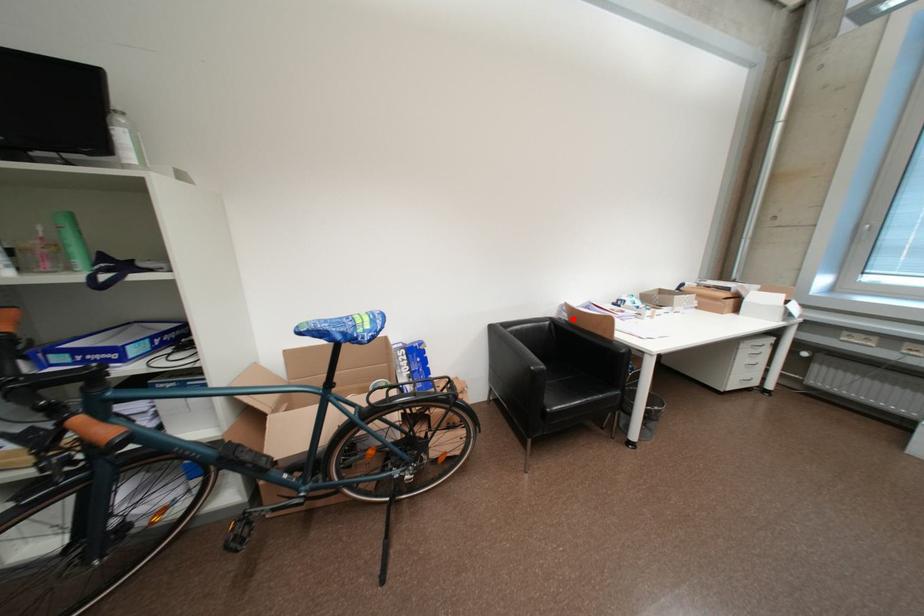
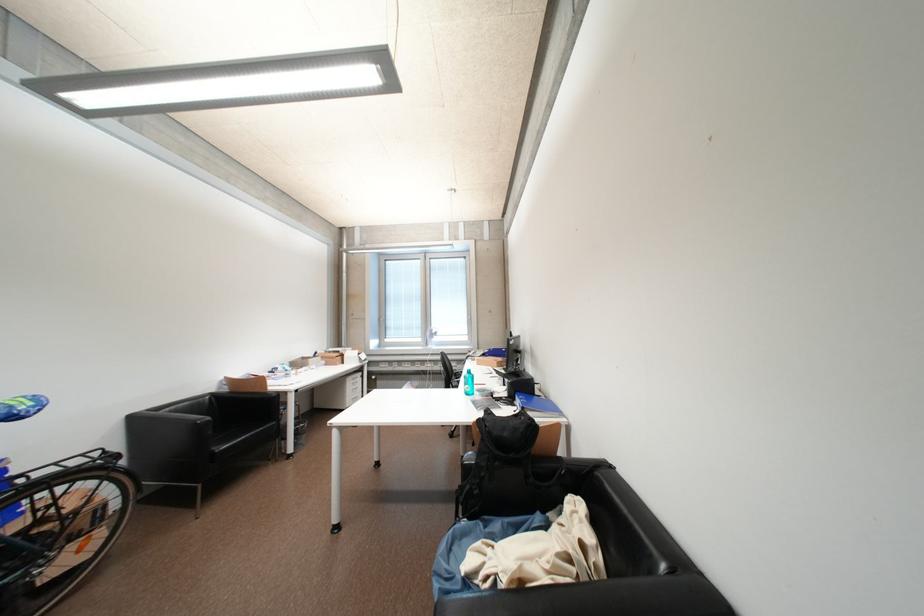
Locate, in the second image, the point that corresponds to the highlighted location in the first image.

(234, 391)